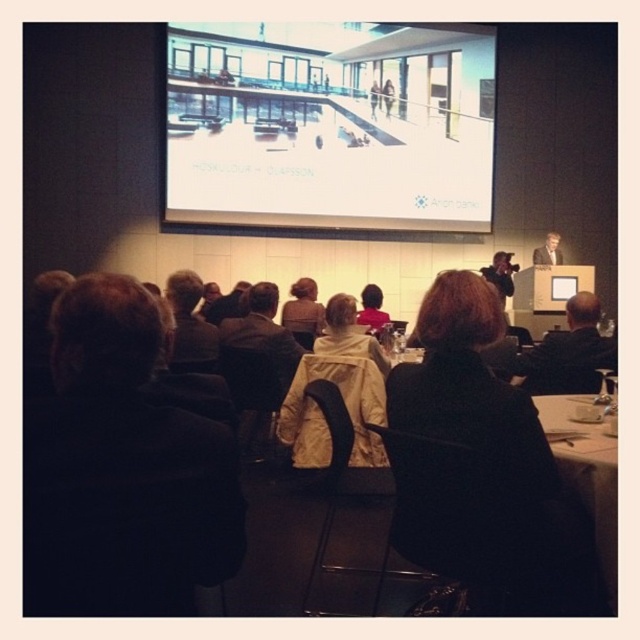
Question: In this image, where is dark brown hair at left located relative to white tablecloth at lower right?

Choices:
 (A) right
 (B) left

Answer: (B)

Question: Which of these objects is positioned closest to the brown hair at center?

Choices:
 (A) smooth skin face at upper right
 (B) transparent glass building at upper center
 (C) pink fabric at center
 (D) light beige jacket at center

Answer: (D)

Question: Does dark brown hair at left appear under pink fabric at center?

Choices:
 (A) yes
 (B) no

Answer: (A)

Question: Which point is farther from the camera taking this photo?

Choices:
 (A) (176, 340)
 (B) (508, 598)
 (C) (228, 486)
 (D) (560, 429)

Answer: (A)

Question: Is black suit at right to the right of brown fabric jacket at center from the viewer's perspective?

Choices:
 (A) yes
 (B) no

Answer: (A)

Question: Among these objects, which one is nearest to the camera?

Choices:
 (A) black suit at right
 (B) smooth skin face at upper right
 (C) light beige jacket at center

Answer: (A)